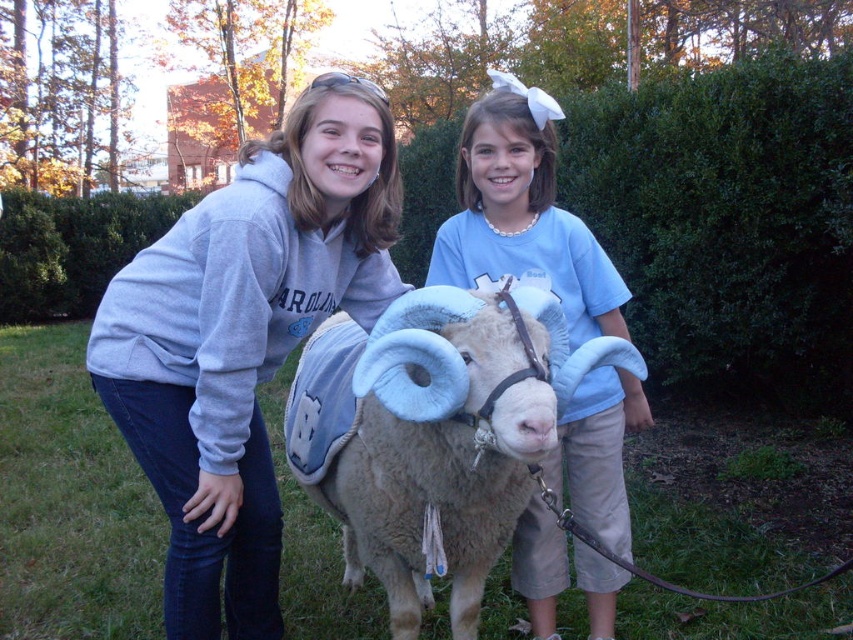
Which is in front, point (548, 352) or point (521, 531)?

Point (548, 352) is more forward.

Does point (566, 342) come closer to viewer compared to point (578, 264)?

Yes.

Locate an element on the screen. The height and width of the screenshot is (640, 853). light brown woolen sheep at center is located at coordinates (431, 435).

Who is positioned more to the left, gray fleece sweatshirt at left or light brown woolen sheep at center?

gray fleece sweatshirt at left is more to the left.

Can you confirm if gray fleece sweatshirt at left is shorter than light brown woolen sheep at center?

In fact, gray fleece sweatshirt at left may be taller than light brown woolen sheep at center.

Does point (247, 230) come in front of point (316, 476)?

Yes, point (247, 230) is in front of point (316, 476).

Where is `gray fleece sweatshirt at left`? This screenshot has height=640, width=853. gray fleece sweatshirt at left is located at coordinates (244, 339).

Does gray fleece sweatshirt at left appear on the right side of blue cotton shirt at center?

In fact, gray fleece sweatshirt at left is to the left of blue cotton shirt at center.

Between gray fleece sweatshirt at left and blue cotton shirt at center, which one has more height?

Standing taller between the two is blue cotton shirt at center.

In order to click on gray fleece sweatshirt at left in this screenshot , I will do `click(244, 339)`.